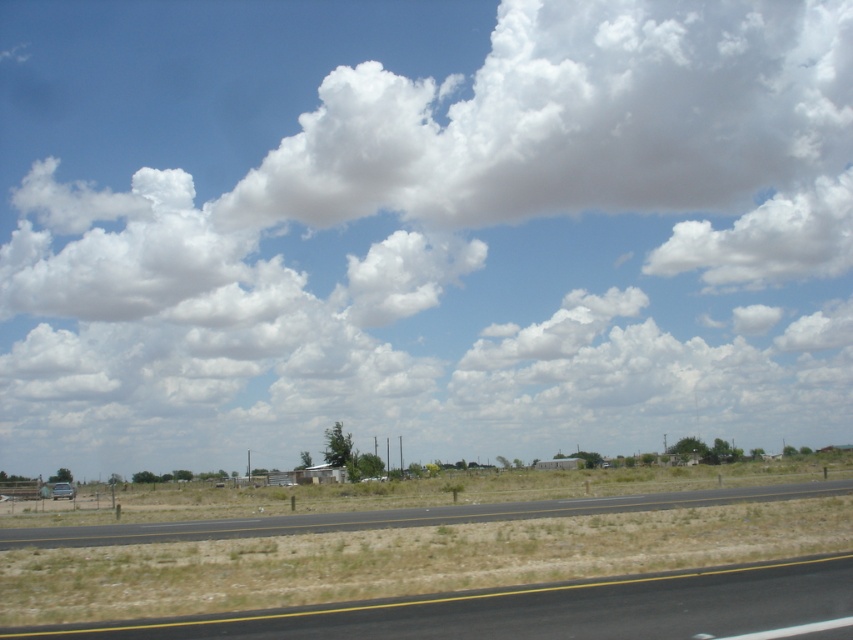
Question: Which object is farther from the camera taking this photo?

Choices:
 (A) clear glass window at lower left
 (B) asphalt road at lower center

Answer: (A)

Question: Where is asphalt road at lower center located in relation to clear glass window at lower left in the image?

Choices:
 (A) right
 (B) left

Answer: (A)

Question: Can you confirm if asphalt road at lower center is smaller than clear glass window at lower left?

Choices:
 (A) no
 (B) yes

Answer: (B)

Question: Among these points, which one is farthest from the camera?

Choices:
 (A) (328, 605)
 (B) (523, 508)

Answer: (B)

Question: Which of the following is the closest to the observer?

Choices:
 (A) clear glass window at lower left
 (B) asphalt road at lower center

Answer: (B)

Question: Does white fluffy cloud at upper center have a lesser width compared to black asphalt road at lower center?

Choices:
 (A) yes
 (B) no

Answer: (B)